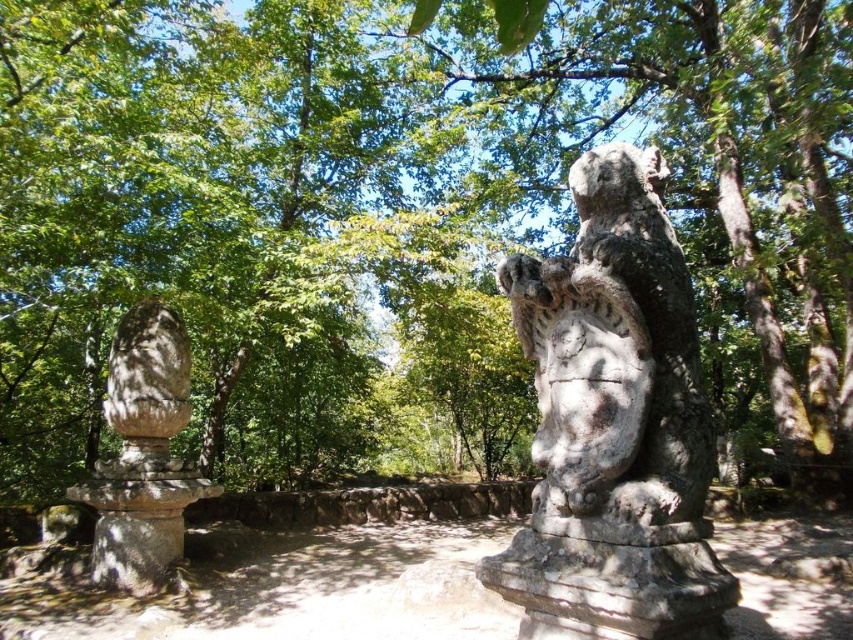
Question: Does weathered stone owl at upper right lie in front of rough stone statue at left?

Choices:
 (A) yes
 (B) no

Answer: (A)

Question: Is weathered stone owl at upper right positioned in front of rough stone statue at left?

Choices:
 (A) no
 (B) yes

Answer: (B)

Question: Which point appears farthest from the camera in this image?

Choices:
 (A) (186, 408)
 (B) (585, 506)

Answer: (A)

Question: Observing the image, what is the correct spatial positioning of weathered stone owl at upper right in reference to rough stone statue at left?

Choices:
 (A) left
 (B) right

Answer: (B)

Question: Which point is closer to the camera taking this photo?

Choices:
 (A) [x=169, y=458]
 (B) [x=692, y=528]

Answer: (B)